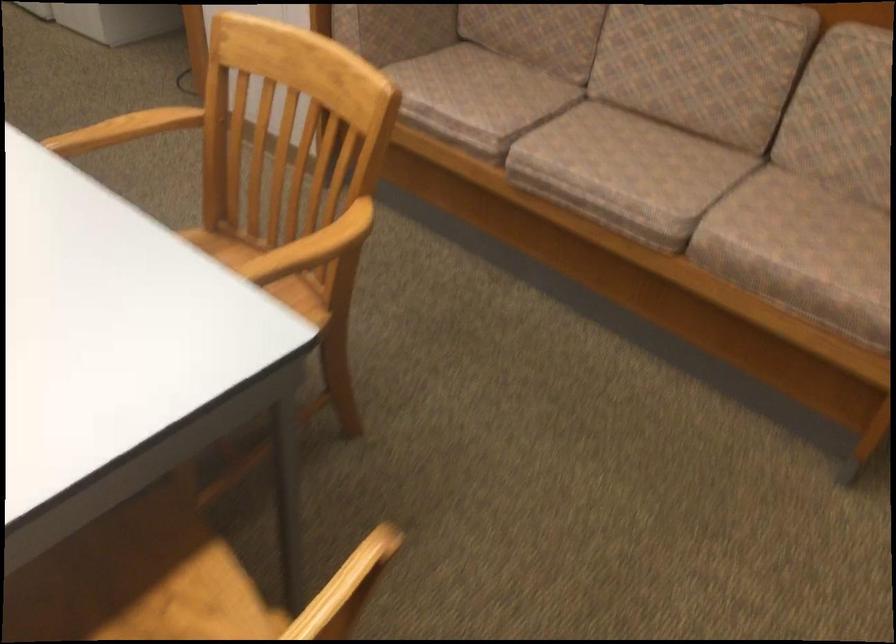
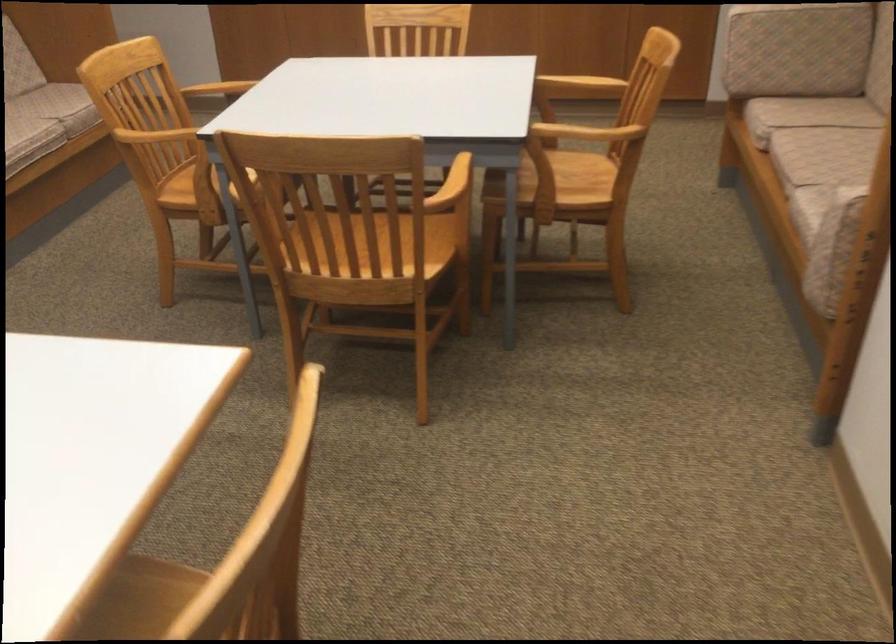
The point at (319,243) is marked in the first image. Where is the corresponding point in the second image?

(218, 89)